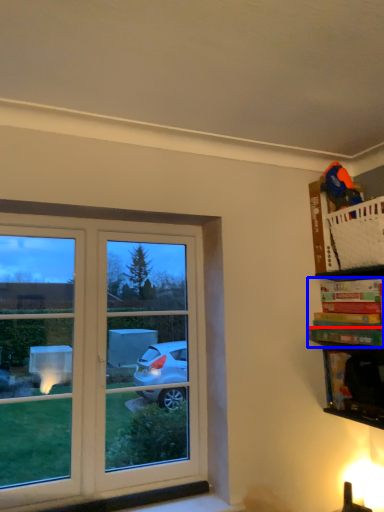
Question: Which object is closer to the camera taking this photo, book (highlighted by a red box) or book (highlighted by a blue box)?

Choices:
 (A) book
 (B) book

Answer: (A)